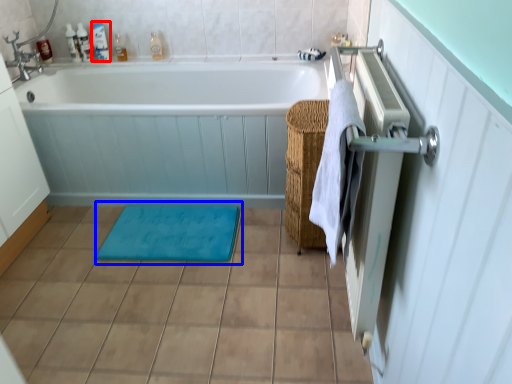
Question: Which of the following is the closest to the observer, toiletry (highlighted by a red box) or bath mat (highlighted by a blue box)?

Choices:
 (A) toiletry
 (B) bath mat

Answer: (B)